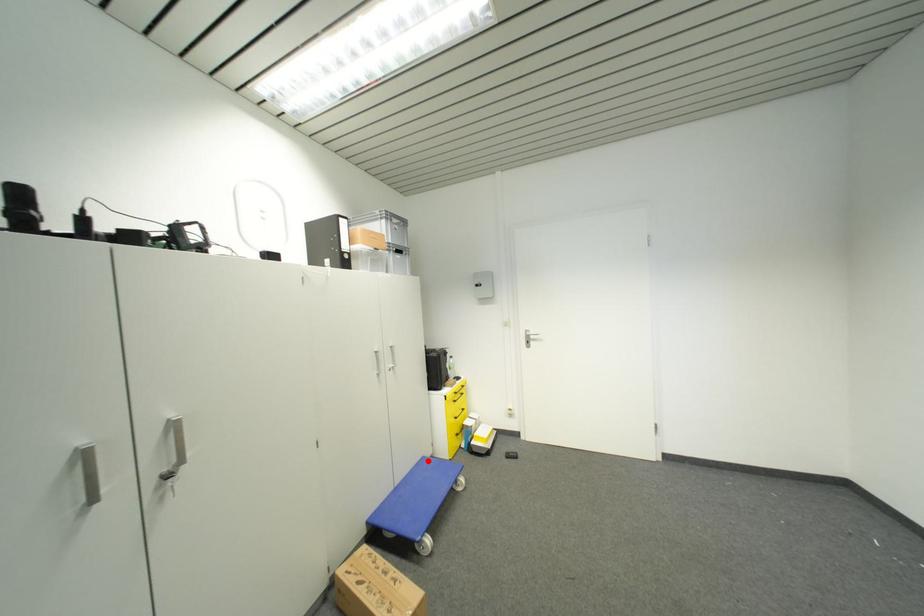
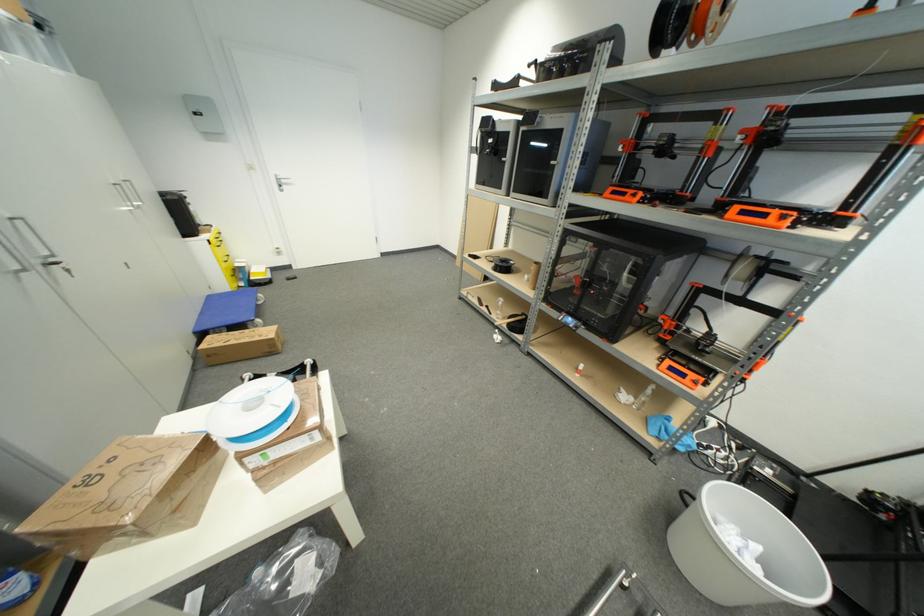
Question: A red point is marked in image1. In image2, is the corresponding 3D point closer to the camera or farther? Reply with the corresponding letter.

Choices:
 (A) The corresponding 3D point is closer.
 (B) The corresponding 3D point is farther.

Answer: (A)